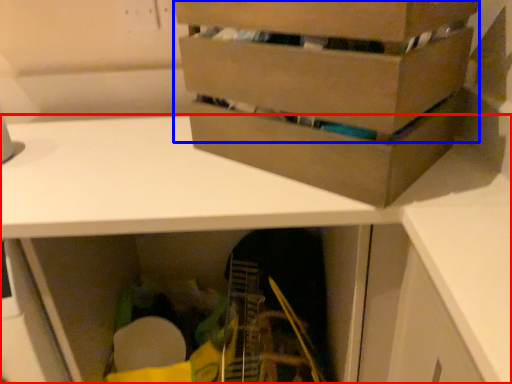
Question: Which of the following is the closest to the observer, desk (highlighted by a red box) or box (highlighted by a blue box)?

Choices:
 (A) desk
 (B) box

Answer: (B)